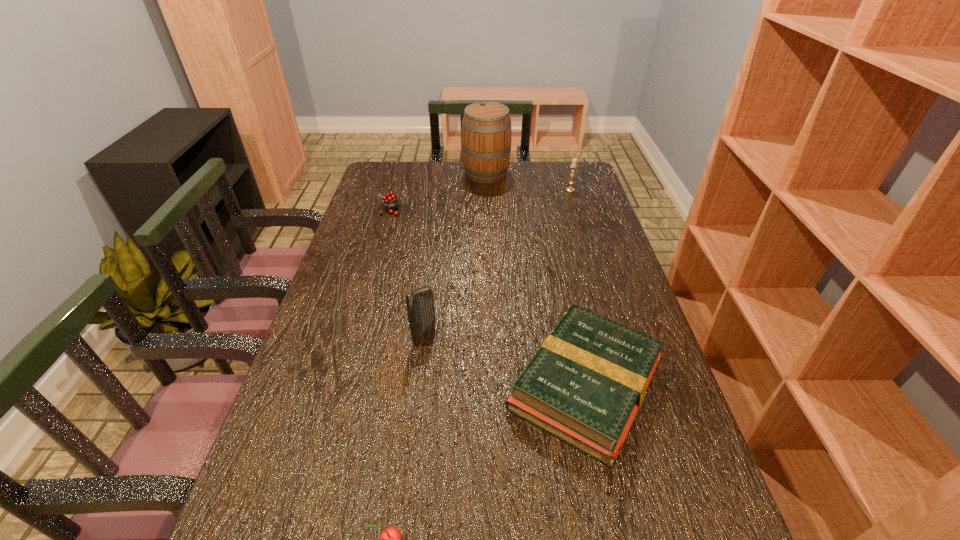
Identify the location of the tallest object. (486, 126).

Locate an element on the screen. the farthest object is located at coordinates (486, 126).

The width and height of the screenshot is (960, 540). What are the coordinates of `cellular telephone` in the screenshot? It's located at (420, 306).

Where is `the fifth nearest object`? The image size is (960, 540). the fifth nearest object is located at coordinates (573, 165).

The height and width of the screenshot is (540, 960). In order to click on candle holder in this screenshot , I will do pyautogui.click(x=573, y=165).

Find the location of a particular element. Image resolution: width=960 pixels, height=540 pixels. hardback book is located at coordinates (585, 385).

Find the location of `the farther cherry`. the farther cherry is located at coordinates (390, 202).

Where is `the left cherry`? The image size is (960, 540). the left cherry is located at coordinates (390, 202).

Where is `free space located on the left of the farthest object`? This screenshot has width=960, height=540. free space located on the left of the farthest object is located at coordinates (389, 173).

The image size is (960, 540). Find the location of `vacant space situated 0.160m on the keyboard of the fifth shortest object`. vacant space situated 0.160m on the keyboard of the fifth shortest object is located at coordinates click(x=499, y=335).